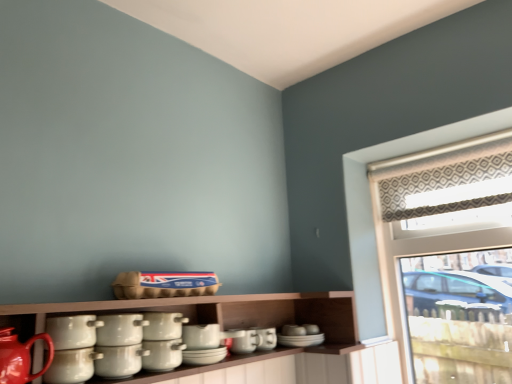
Question: From a real-world perspective, does matte white cup at center, marked as the second tableware in a back-to-front arrangement, stand above white glossy pots at center, marked as the 3th tableware in a front-to-back arrangement?

Choices:
 (A) no
 (B) yes

Answer: (A)

Question: Is matte white cup at center, which is the 8th tableware in front-to-back order, looking in the opposite direction of white glossy pots at center, the seventh tableware when ordered from back to front?

Choices:
 (A) yes
 (B) no

Answer: (B)

Question: Can you confirm if matte white cup at center, marked as the second tableware in a back-to-front arrangement, is positioned to the right of white glossy pots at center, marked as the 3th tableware in a front-to-back arrangement?

Choices:
 (A) yes
 (B) no

Answer: (A)

Question: Can you confirm if matte white cup at center, marked as the second tableware in a back-to-front arrangement, is smaller than white glossy pots at center, the seventh tableware when ordered from back to front?

Choices:
 (A) yes
 (B) no

Answer: (A)

Question: Is matte white cup at center, which is the 8th tableware in front-to-back order, shorter than white glossy pots at center, marked as the 3th tableware in a front-to-back arrangement?

Choices:
 (A) yes
 (B) no

Answer: (B)

Question: Is the depth of matte white cup at center, marked as the second tableware in a back-to-front arrangement, greater than that of white glossy pots at center, the seventh tableware when ordered from back to front?

Choices:
 (A) yes
 (B) no

Answer: (A)

Question: Is matte red teapot at lower left smaller than matte ceramic cup at center, which is the 9th tableware from front to back?

Choices:
 (A) yes
 (B) no

Answer: (B)

Question: Is matte red teapot at lower left positioned far away from matte ceramic cup at center, the first tableware from the back?

Choices:
 (A) no
 (B) yes

Answer: (A)

Question: Is the position of matte red teapot at lower left less distant than that of matte ceramic cup at center, which is the 9th tableware from front to back?

Choices:
 (A) no
 (B) yes

Answer: (B)

Question: From a real-world perspective, is matte red teapot at lower left below matte ceramic cup at center, which is the 9th tableware from front to back?

Choices:
 (A) no
 (B) yes

Answer: (A)

Question: From the image's perspective, is matte red teapot at lower left under matte ceramic cup at center, which is the 9th tableware from front to back?

Choices:
 (A) yes
 (B) no

Answer: (B)

Question: Is matte red teapot at lower left further to the viewer compared to matte ceramic cup at center, which is the 9th tableware from front to back?

Choices:
 (A) no
 (B) yes

Answer: (A)

Question: Can you see white glossy pots at center, which is counted as the 5th tableware, starting from the back, touching matte red teapot at lower left?

Choices:
 (A) no
 (B) yes

Answer: (A)